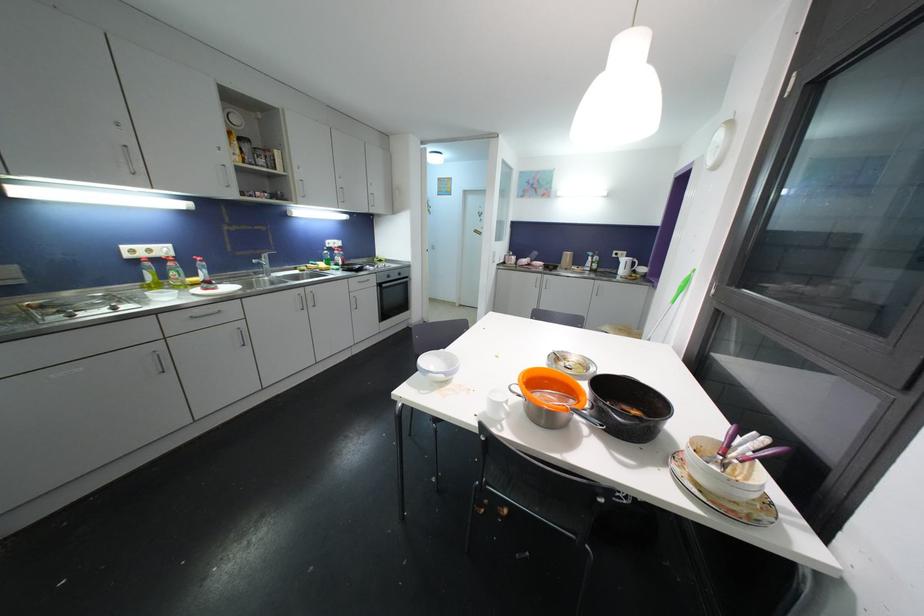
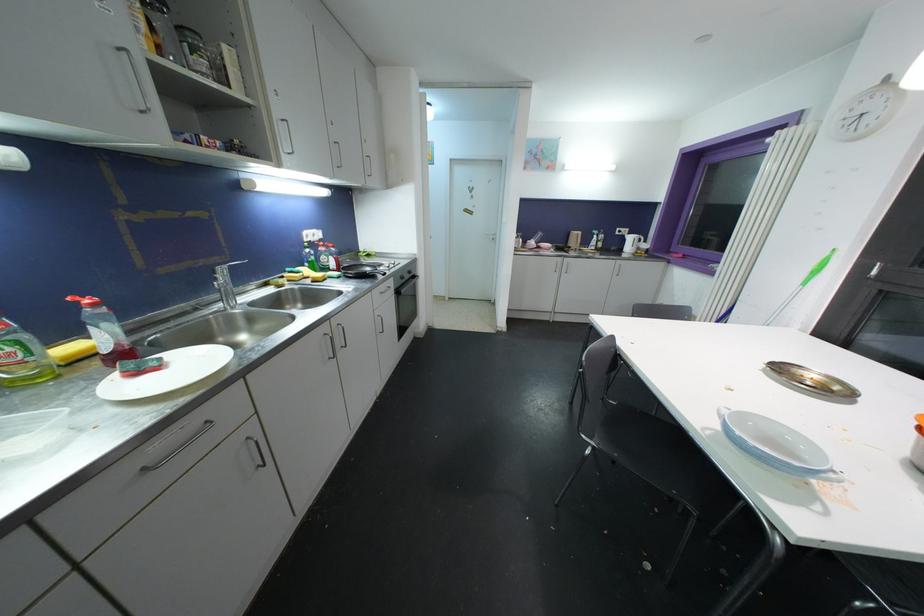
Which direction would the cameraman need to move to produce the second image?

The cameraman moved toward left, forward.